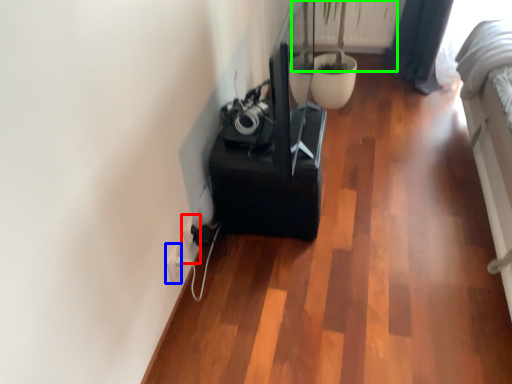
Question: Estimate the real-world distances between objects in this image. Which object is farther from electric outlet (highlighted by a red box), electric outlet (highlighted by a blue box) or plant (highlighted by a green box)?

Choices:
 (A) electric outlet
 (B) plant

Answer: (B)